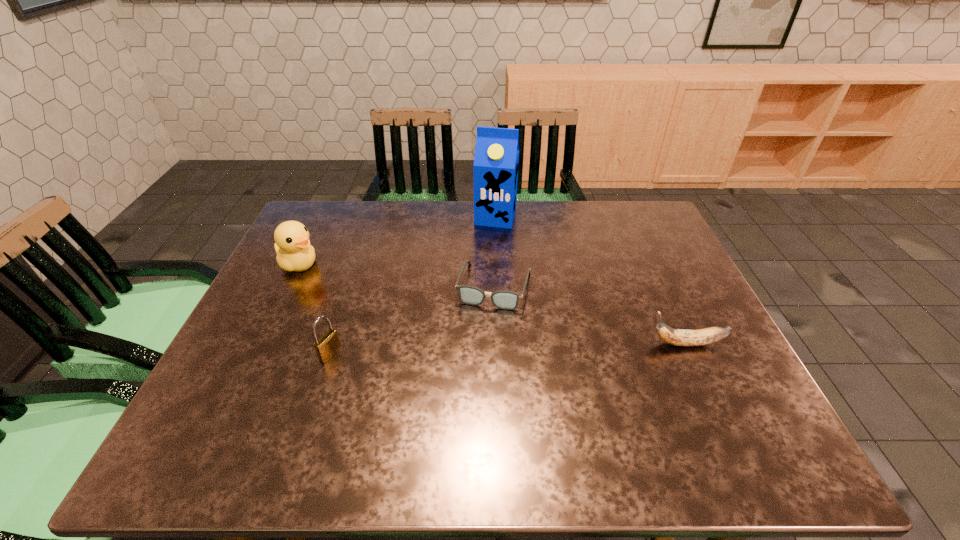
I want to click on vacant space located 0.370m on the peel of the banana, so click(x=492, y=343).

Find the location of a particular element. The height and width of the screenshot is (540, 960). free spot located 0.240m on the peel of the banana is located at coordinates (547, 343).

This screenshot has width=960, height=540. I want to click on blank area located 0.140m on the peel of the banana, so click(589, 343).

You are a GUI agent. You are given a task and a screenshot of the screen. Output one action in this format:
    pyautogui.click(x=<x>, y=<y>)
    Task: Click on the vacant space situated on the face of the shortest object
    The width and height of the screenshot is (960, 540).
    Given the screenshot: What is the action you would take?
    pyautogui.click(x=462, y=400)

Where is `free region located on the face of the shortest object`? This screenshot has width=960, height=540. free region located on the face of the shortest object is located at coordinates (472, 363).

You are a GUI agent. You are given a task and a screenshot of the screen. Output one action in this format:
    pyautogui.click(x=<x>, y=<y>)
    Task: Click on the free location located 0.050m on the face of the shortest object
    This screenshot has height=540, width=960.
    Given the screenshot: What is the action you would take?
    pyautogui.click(x=483, y=325)

Locate an element on the screen. free location located 0.180m with the cap open on the carton is located at coordinates (482, 264).

Image resolution: width=960 pixels, height=540 pixels. What are the coordinates of `vacant space situated 0.230m with the cap open on the carton` in the screenshot? It's located at (479, 275).

I want to click on free region located with the cap open on the carton, so click(487, 249).

Identify the location of free spot located on the face of the duck. This screenshot has width=960, height=540. (362, 291).